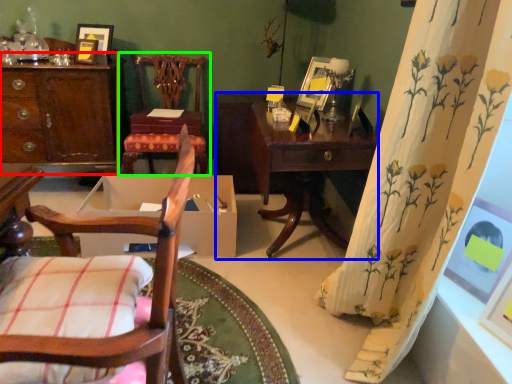
Question: Which object is the closest to the desk (highlighted by a red box)? Choose among these: table (highlighted by a blue box) or chair (highlighted by a green box).

Choices:
 (A) table
 (B) chair

Answer: (B)